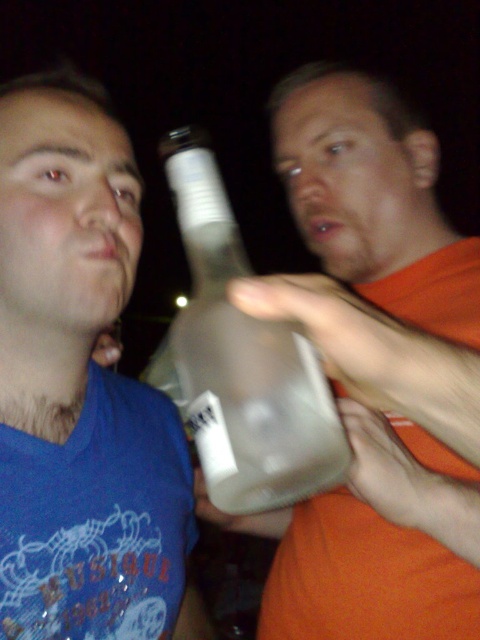
Can you confirm if translucent glass bottle at center is taller than matte plastic bottle at left?

Yes.

Who is more distant from viewer, (x=454, y=272) or (x=13, y=195)?

Positioned behind is point (x=454, y=272).

Locate an element on the screen. The height and width of the screenshot is (640, 480). translucent glass bottle at center is located at coordinates (375, 372).

Is point (417, 387) positioned in front of point (235, 372)?

Yes, point (417, 387) is in front of point (235, 372).

Is point (299, 579) behind point (244, 330)?

That is True.

You are a GUI agent. You are given a task and a screenshot of the screen. Output one action in this format:
    pyautogui.click(x=<x>, y=<y>)
    Task: Click on the translucent glass bottle at center
    The height and width of the screenshot is (640, 480).
    Given the screenshot: What is the action you would take?
    pyautogui.click(x=375, y=372)

Between matte plastic bottle at left and transparent plastic bottle at center, which one has less height?

transparent plastic bottle at center is shorter.

What are the coordinates of `matte plastic bottle at left` in the screenshot? It's located at (78, 349).